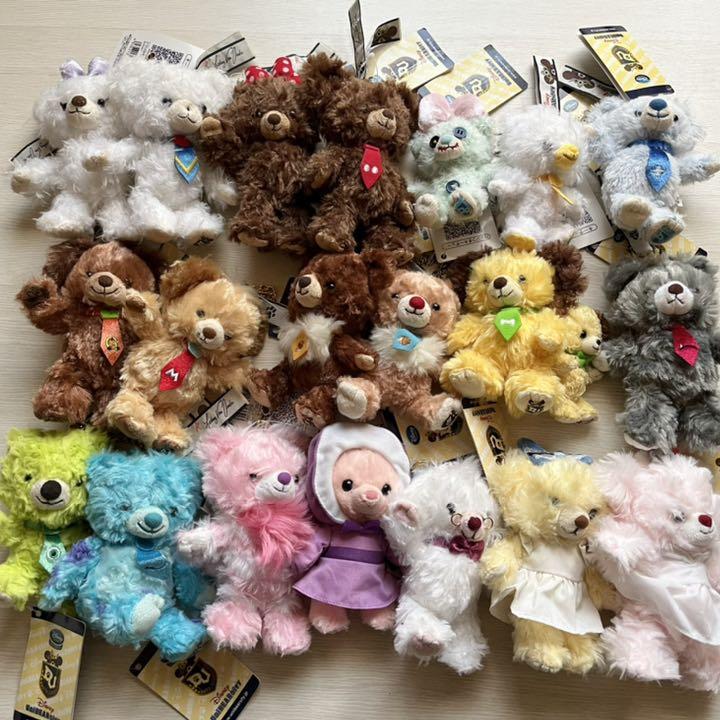
At what (x,y) coordinates should I click in order to perform the action: click on plush bears leaning to the right. Please return your answer as a coordinate pair (x, y). The image size is (720, 720). Looking at the image, I should click on tap(163, 163), tap(356, 153), tap(533, 166), tap(646, 163), tap(261, 531), tap(450, 541), tap(552, 553), tap(659, 554).